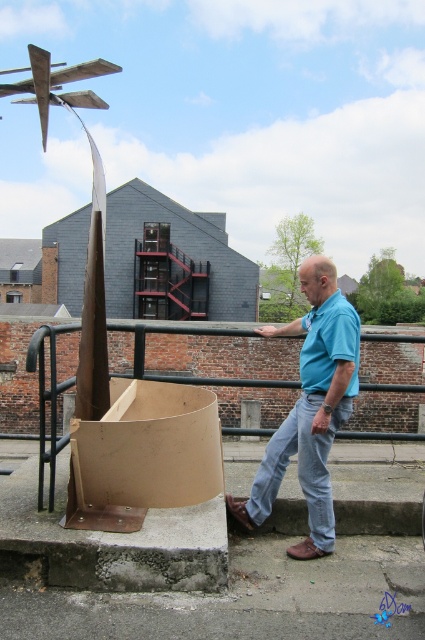
Question: Which object is closer to the camera taking this photo?

Choices:
 (A) brown metal rail at center
 (B) light blue denim jeans at lower center
 (C) blue cotton shirt at center

Answer: (A)

Question: Which object is farther from the camera taking this photo?

Choices:
 (A) brown metal rail at center
 (B) blue cotton shirt at center

Answer: (B)

Question: Does brown metal rail at center have a greater width compared to light blue denim jeans at lower center?

Choices:
 (A) yes
 (B) no

Answer: (A)

Question: Which object is farther from the camera taking this photo?

Choices:
 (A) brown metal rail at center
 (B) light blue denim jeans at lower center

Answer: (B)

Question: Can you confirm if blue cotton shirt at center is smaller than light blue denim jeans at lower center?

Choices:
 (A) no
 (B) yes

Answer: (A)

Question: Does brown metal rail at center come behind light blue denim jeans at lower center?

Choices:
 (A) yes
 (B) no

Answer: (B)